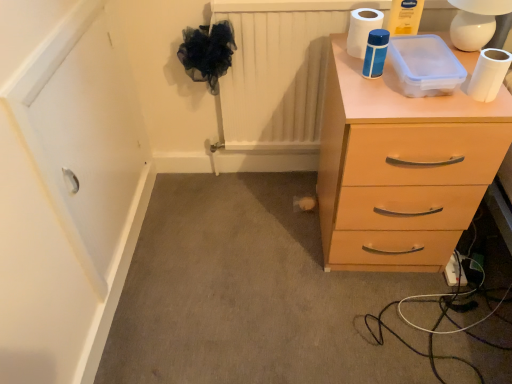
Question: Considering their positions, is white matte toilet paper at upper right, which is the second toilet paper from back to front, located in front of or behind white plastic extension cord at lower right?

Choices:
 (A) behind
 (B) front

Answer: (B)

Question: From their relative heights in the image, would you say white matte toilet paper at upper right, the 1th toilet paper from the right, is taller or shorter than white plastic extension cord at lower right?

Choices:
 (A) short
 (B) tall

Answer: (B)

Question: Which object is positioned closest to the light wood chest of drawers at right?

Choices:
 (A) white matte toilet paper at upper right, the 1th toilet paper from the right
 (B) white matte toilet paper at upper right, the 1th toilet paper in the top-to-bottom sequence
 (C) white plastic extension cord at lower right

Answer: (A)

Question: Estimate the real-world distances between objects in this image. Which object is closer to the light wood chest of drawers at right?

Choices:
 (A) white matte toilet paper at upper right, which appears as the 1th toilet paper when ordered from the bottom
 (B) white matte toilet paper at upper right, the second toilet paper ordered from the bottom
 (C) white plastic extension cord at lower right

Answer: (A)